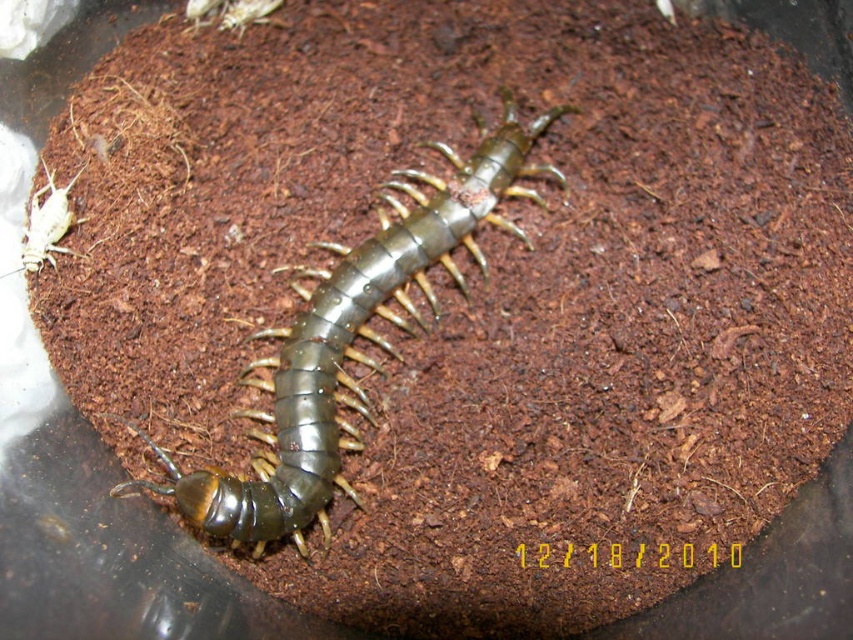
Based on the photo, is shiny metallic centipede at center wider than white matte cricket at left?

Yes, shiny metallic centipede at center is wider than white matte cricket at left.

Can you confirm if shiny metallic centipede at center is positioned below white matte cricket at left?

Indeed, shiny metallic centipede at center is positioned under white matte cricket at left.

Find the location of a particular element. The width and height of the screenshot is (853, 640). shiny metallic centipede at center is located at coordinates (349, 342).